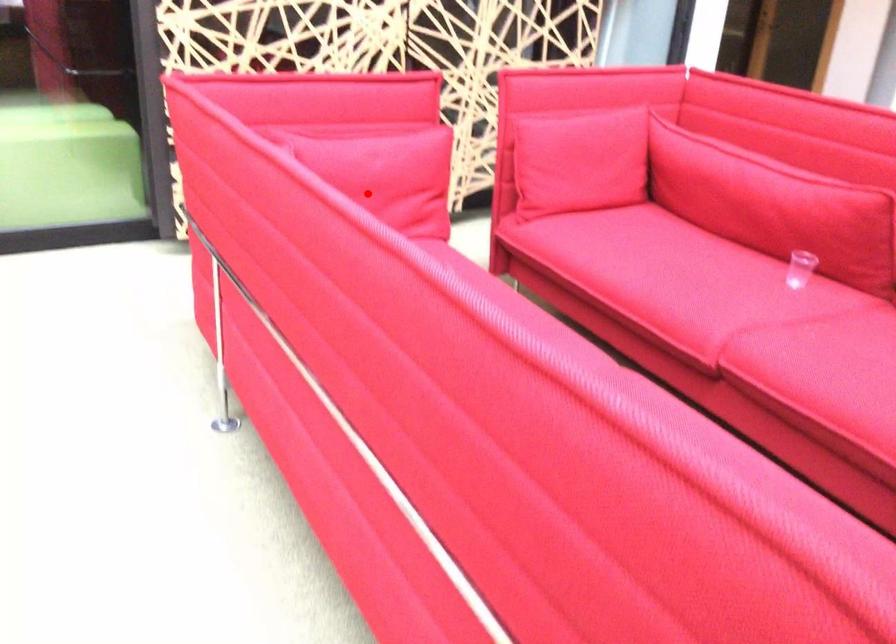
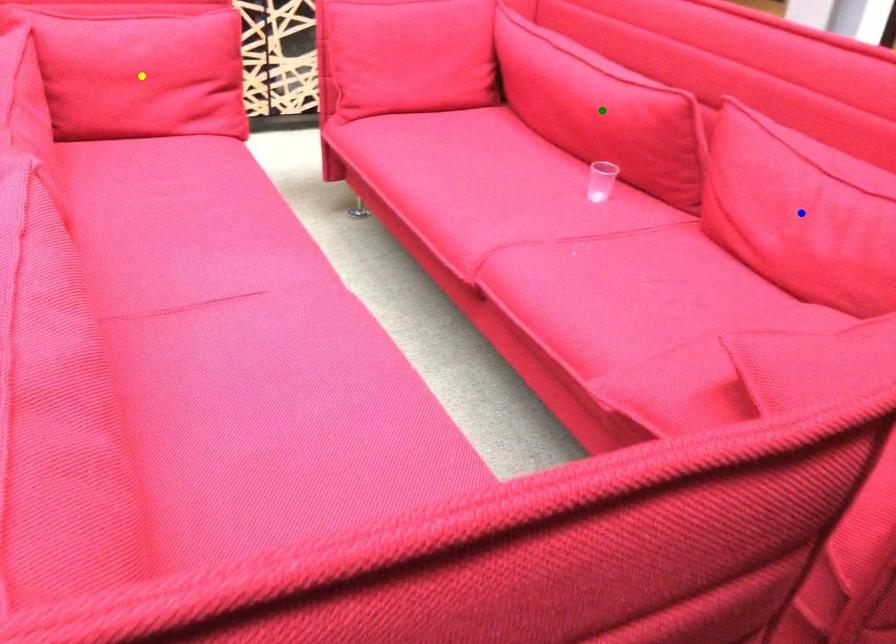
Question: I am providing you with two images of the same scene from different viewpoints. A red point is marked on the first image. You are given multiple points on the second image. Can you choose the point in image 2 that corresponds to the point in image 1?

Choices:
 (A) green point
 (B) blue point
 (C) yellow point

Answer: (C)